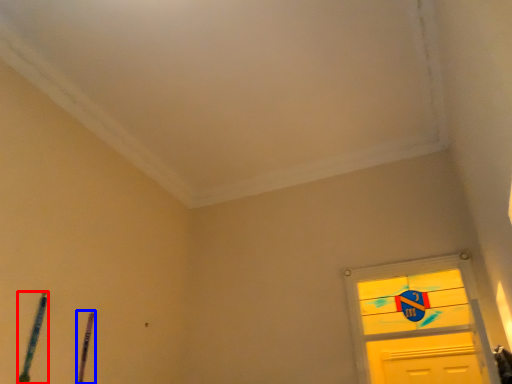
Question: Which object appears farthest to the camera in this image, twin (highlighted by a red box) or twin (highlighted by a blue box)?

Choices:
 (A) twin
 (B) twin

Answer: (B)